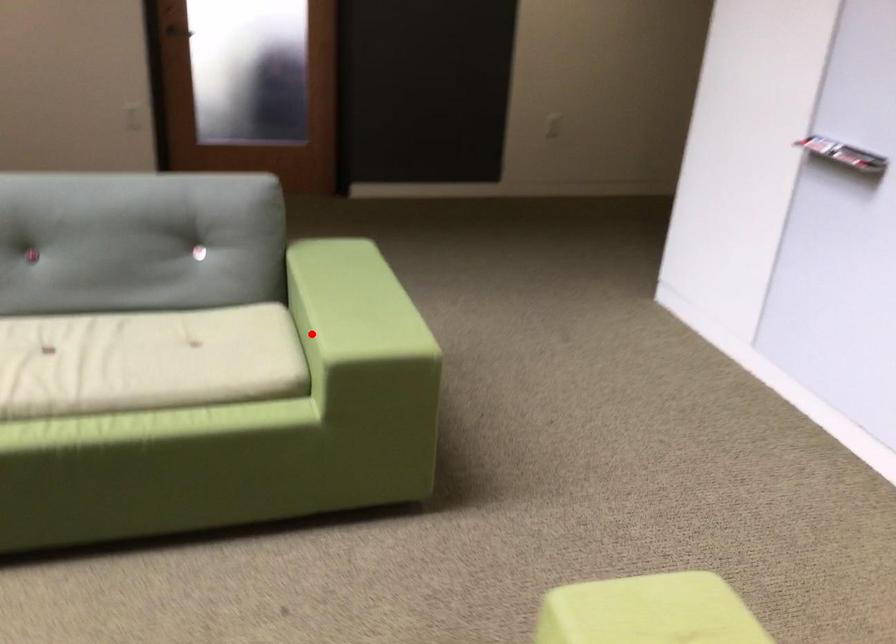
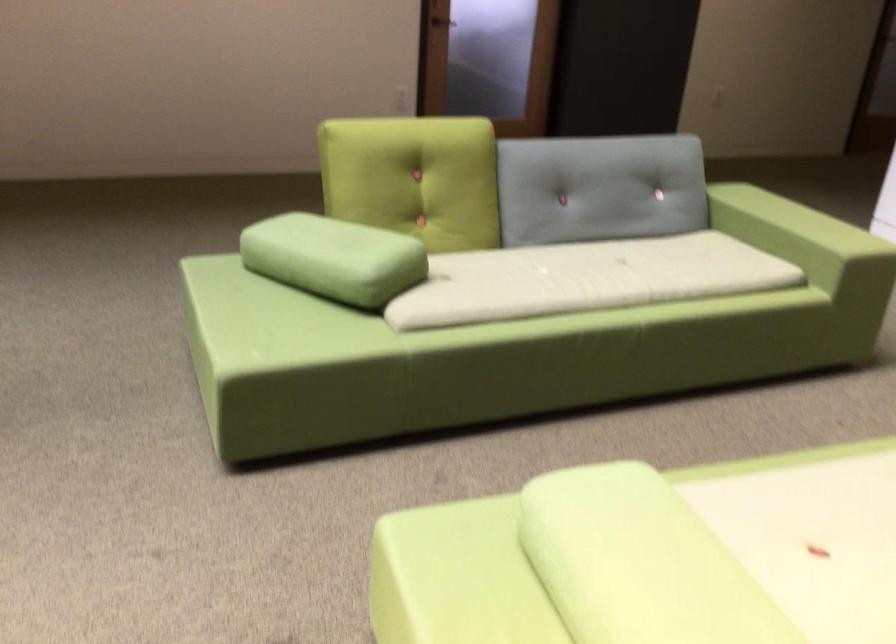
Question: A red point is marked in image1. In image2, is the corresponding 3D point closer to the camera or farther? Reply with the corresponding letter.

Choices:
 (A) The corresponding 3D point is closer.
 (B) The corresponding 3D point is farther.

Answer: (B)